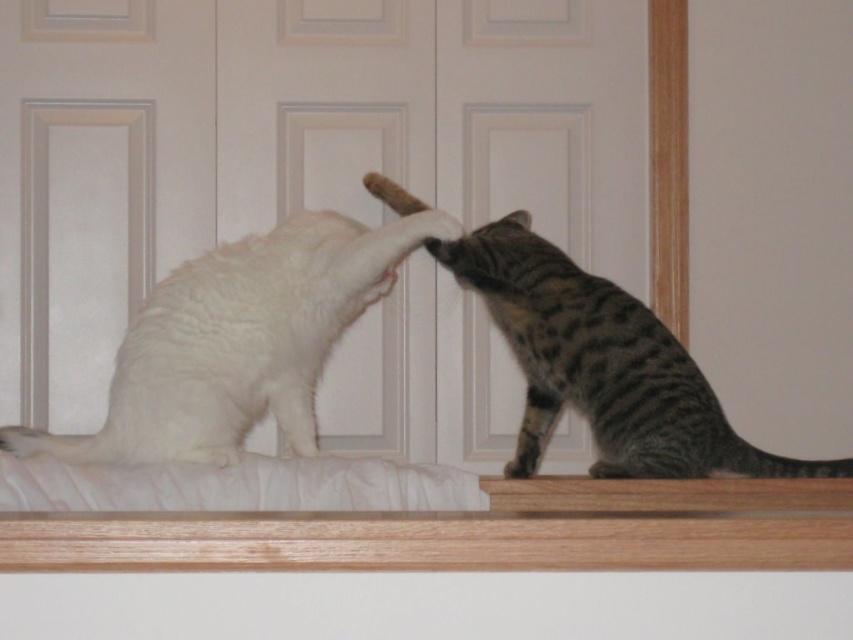
Question: Where is white fluffy cat at left located in relation to gray striped cat at upper right in the image?

Choices:
 (A) below
 (B) above

Answer: (B)

Question: Can you confirm if white fluffy cat at left is bigger than gray striped cat at upper right?

Choices:
 (A) no
 (B) yes

Answer: (A)

Question: Which object appears farthest from the camera in this image?

Choices:
 (A) gray striped cat at upper right
 (B) white fluffy cat at left

Answer: (A)

Question: Which point appears closest to the camera in this image?

Choices:
 (A) (268, 381)
 (B) (614, 301)

Answer: (A)

Question: Is white fluffy cat at left smaller than gray striped cat at upper right?

Choices:
 (A) no
 (B) yes

Answer: (B)